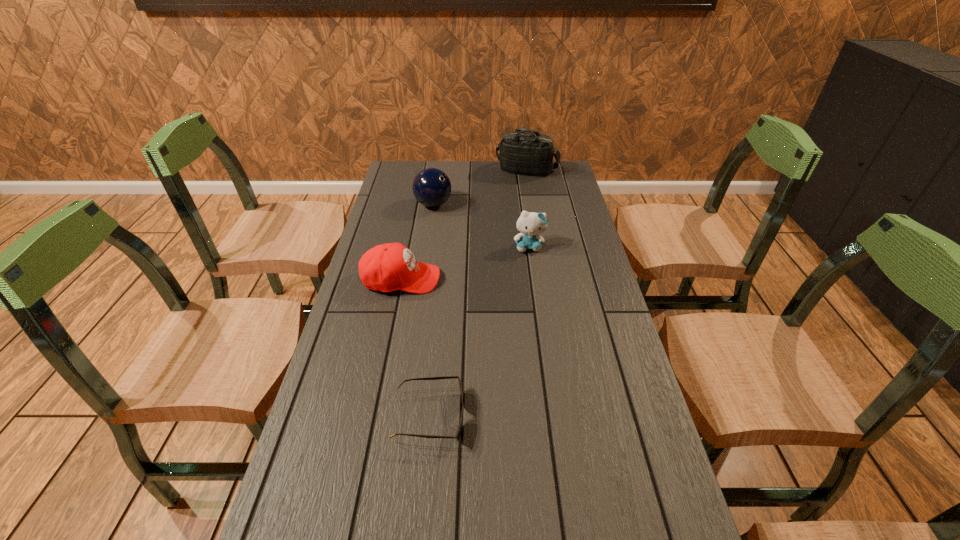
Locate an element on the screen. The image size is (960, 540). the fourth closest object relative to the second nearest object is located at coordinates (522, 153).

Point out which object is positioned as the fourth nearest to the tallest object. Please provide its 2D coordinates. Your answer should be formatted as a tuple, i.e. [(x, y)], where the tuple contains the x and y coordinates of a point satisfying the conditions above.

[(458, 435)]

Identify the location of vacant position in the image that satisfies the following two spatial constraints: 1. at the front padded panel of the farthest object; 2. on the front panel of the fourth farthest object. The image size is (960, 540). (545, 279).

Locate an element on the screen. The width and height of the screenshot is (960, 540). free location that satisfies the following two spatial constraints: 1. at the front padded panel of the tallest object; 2. on the lenses of the nearest object is located at coordinates (568, 416).

Identify the location of free space that satisfies the following two spatial constraints: 1. at the front padded panel of the shoulder bag; 2. on the surface of the bowling ball near the finger holes. The width and height of the screenshot is (960, 540). (533, 205).